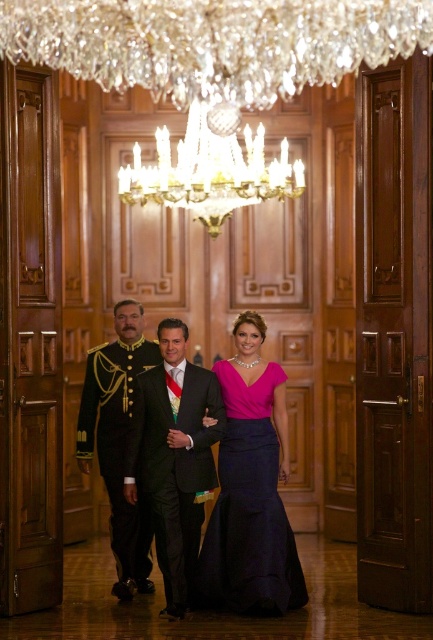
Between matte pink dress at center and shiny black suit at center, which one appears on the left side from the viewer's perspective?

Positioned to the left is shiny black suit at center.

Who is shorter, matte pink dress at center or shiny black suit at center?

Standing shorter between the two is shiny black suit at center.

Is point (283, 588) positioned behind point (158, 554)?

No, it is in front of (158, 554).

Where is `matte pink dress at center`? The height and width of the screenshot is (640, 433). matte pink dress at center is located at coordinates (215, 476).

Looking at this image, does shiny black suit at center have a greater width compared to shiny black uniform at center?

Yes.

Does shiny black suit at center have a lesser width compared to shiny black uniform at center?

In fact, shiny black suit at center might be wider than shiny black uniform at center.

I want to click on shiny black suit at center, so click(174, 458).

Is purple satin dress at center taller than shiny black uniform at center?

Incorrect, purple satin dress at center's height is not larger of shiny black uniform at center's.

You are a GUI agent. You are given a task and a screenshot of the screen. Output one action in this format:
    pyautogui.click(x=<x>, y=<y>)
    Task: Click on the purple satin dress at center
    The width and height of the screenshot is (433, 640).
    Given the screenshot: What is the action you would take?
    pyautogui.click(x=248, y=508)